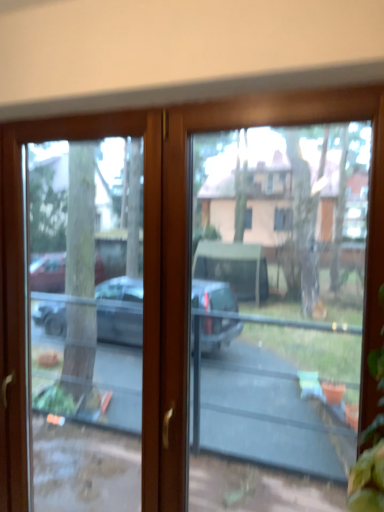
Question: Considering the positions of point (153, 468) and point (208, 420), is point (153, 468) closer or farther from the camera than point (208, 420)?

Choices:
 (A) closer
 (B) farther

Answer: (A)

Question: Looking at the image, does transparent glass screen door at left seem bigger or smaller compared to transparent glass door at center?

Choices:
 (A) big
 (B) small

Answer: (A)

Question: Considering the positions of transparent glass screen door at left and transparent glass door at center in the image, is transparent glass screen door at left wider or thinner than transparent glass door at center?

Choices:
 (A) wide
 (B) thin

Answer: (B)

Question: Is point (307, 141) closer or farther from the camera than point (153, 425)?

Choices:
 (A) farther
 (B) closer

Answer: (A)

Question: Considering their positions, is transparent glass door at center located in front of or behind transparent glass screen door at left?

Choices:
 (A) behind
 (B) front

Answer: (B)

Question: From the image's perspective, is transparent glass door at center above or below transparent glass screen door at left?

Choices:
 (A) below
 (B) above

Answer: (B)

Question: Would you say transparent glass door at center is to the left or to the right of transparent glass screen door at left in the picture?

Choices:
 (A) left
 (B) right

Answer: (B)